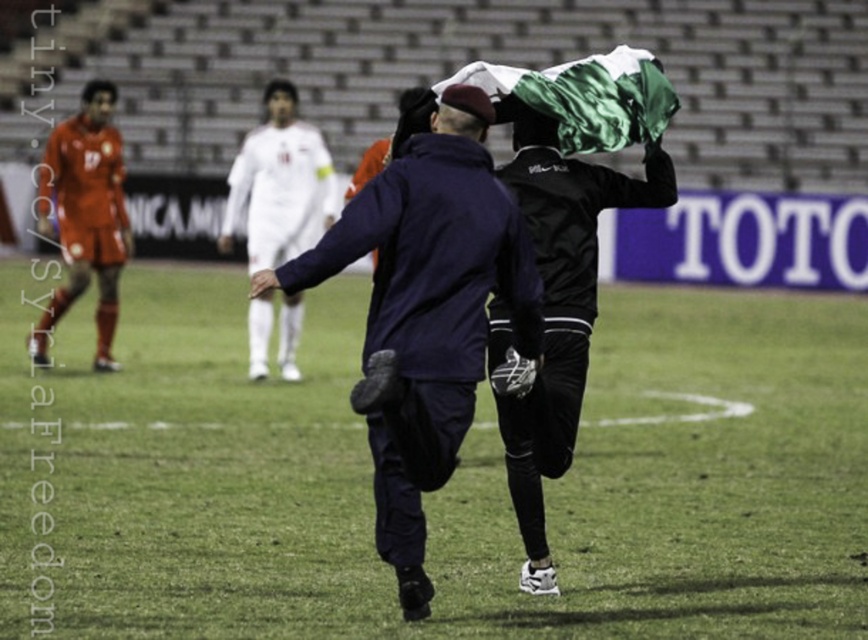
You are a photographer standing at the edge of the soccer field. You want to capture a photo where the green grass at center is visible beneath the black matte jacket at center. Is this possible based on their current positions?

Yes, the green grass at center is positioned under the black matte jacket at center, so it is possible to capture the green grass at center beneath the black matte jacket at center in the photo.

You are a referee on the soccer field and need to determine the position of the green grass at center and the black matte jacket at center. Which object is positioned to the left?

The green grass at center is to the left of the black matte jacket at center.

You are a photographer positioned at the back of the soccer field. You need to take a photo that includes both the dark blue jacket at center and the orange jersey at left. Based on their heights, which player should you focus on first to ensure both are in frame?

The dark blue jacket at center is shorter than the orange jersey at left, so you should focus on the orange jersey at left first to ensure both are visible in the photo.